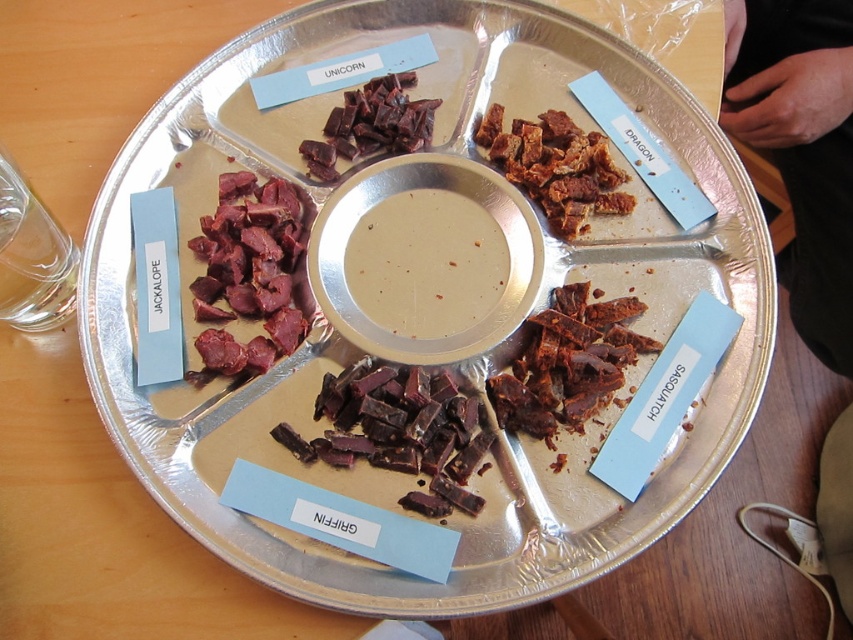
This screenshot has height=640, width=853. Describe the element at coordinates (248, 275) in the screenshot. I see `dark red meat at lower left` at that location.

You are a GUI agent. You are given a task and a screenshot of the screen. Output one action in this format:
    pyautogui.click(x=<x>, y=<y>)
    Task: Click on the dark red meat at lower left
    The image size is (853, 640).
    Given the screenshot: What is the action you would take?
    pyautogui.click(x=248, y=275)

This screenshot has height=640, width=853. Identify the location of dark red meat at lower left. (248, 275).

What do you see at coordinates (248, 275) in the screenshot? The height and width of the screenshot is (640, 853). I see `dark red meat at lower left` at bounding box center [248, 275].

Is dark red meat at lower left thinner than dark brown chewy meat at upper center?

Correct, dark red meat at lower left's width is less than dark brown chewy meat at upper center's.

Is point (292, 289) positioned before point (312, 168)?

Yes, point (292, 289) is in front of point (312, 168).

Where is `dark red meat at lower left`? Image resolution: width=853 pixels, height=640 pixels. dark red meat at lower left is located at coordinates (248, 275).

Can you confirm if dark brown chewy meat at center is taller than brown crumbly snack at upper right?

In fact, dark brown chewy meat at center may be shorter than brown crumbly snack at upper right.

Can you confirm if dark brown chewy meat at center is positioned below brown crumbly snack at upper right?

Correct, dark brown chewy meat at center is located below brown crumbly snack at upper right.

Identify the location of dark brown chewy meat at center. This screenshot has width=853, height=640. (399, 432).